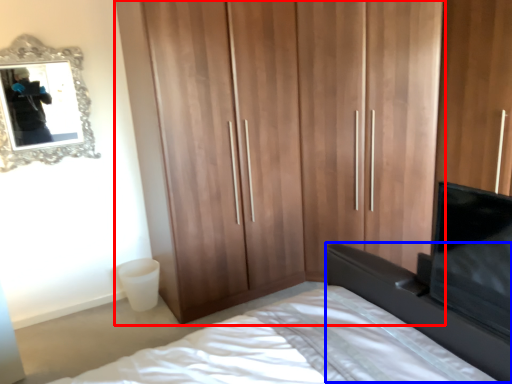
Question: Which point is closer to the camera, cupboard (highlighted by a red box) or vanity (highlighted by a blue box)?

Choices:
 (A) cupboard
 (B) vanity

Answer: (B)